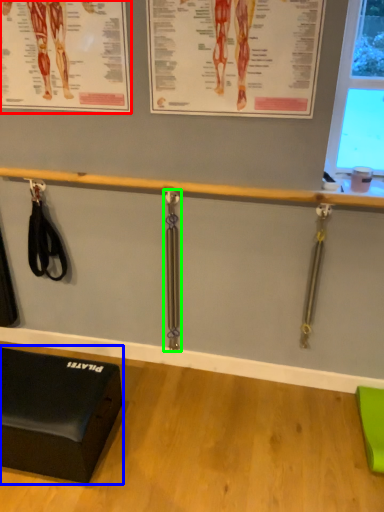
Question: Which object is positioned closest to poster page (highlighted by a red box)? Select from furniture (highlighted by a blue box) and weight (highlighted by a green box).

Choices:
 (A) furniture
 (B) weight

Answer: (B)